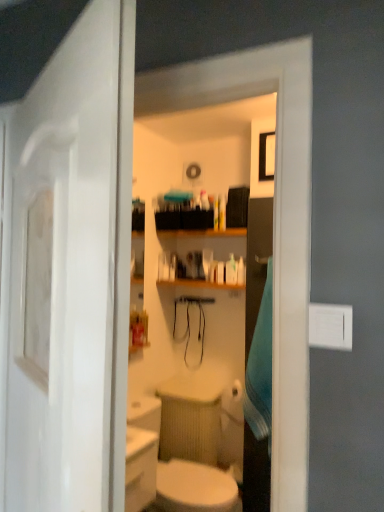
Where is `blue fabric towel at right`? The width and height of the screenshot is (384, 512). blue fabric towel at right is located at coordinates (261, 368).

Locate an element on the screen. blue fabric towel at right is located at coordinates (261, 368).

Does white glossy door at left have a lesser height compared to white glossy sink at lower center?

No, white glossy door at left is not shorter than white glossy sink at lower center.

From the image's perspective, which is below, white glossy door at left or white glossy sink at lower center?

white glossy sink at lower center, from the image's perspective.

From the picture: Between white glossy door at left and white glossy sink at lower center, which one appears on the right side from the viewer's perspective?

white glossy sink at lower center is more to the right.

Looking at this image, can you confirm if white glossy door at left is bigger than white glossy sink at lower center?

Incorrect, white glossy door at left is not larger than white glossy sink at lower center.

Looking at this image, what's the angular difference between blue fabric towel at right and white glossy door at left's facing directions?

The facing directions of blue fabric towel at right and white glossy door at left are 151 degrees apart.

In the image, is blue fabric towel at right on the left side or the right side of white glossy door at left?

blue fabric towel at right is positioned on white glossy door at left's right side.

Considering the positions of objects blue fabric towel at right and white glossy door at left in the image provided, who is behind, blue fabric towel at right or white glossy door at left?

blue fabric towel at right is further away from the camera.

I want to click on door lying above the blue fabric towel at right (from the image's perspective), so click(x=61, y=274).

From the picture: Which point is more forward, (36, 282) or (249, 391)?

The point (36, 282) is more forward.

Is white glossy door at left aimed at blue fabric towel at right?

Yes, white glossy door at left is aimed at blue fabric towel at right.

From a real-world perspective, which object stands above the other?

white glossy door at left.

From the picture: From the image's perspective, between blue fabric towel at right and white glossy sink at lower center, which one is located above?

blue fabric towel at right appears higher in the image.

From the picture: Is blue fabric towel at right inside the boundaries of white glossy sink at lower center, or outside?

blue fabric towel at right is not enclosed by white glossy sink at lower center.

From a real-world perspective, is blue fabric towel at right positioned over white glossy sink at lower center based on gravity?

Yes.

How distant is blue fabric towel at right from white glossy sink at lower center?

blue fabric towel at right is 21.36 inches from white glossy sink at lower center.

From the image's perspective, is white glossy sink at lower center beneath white glossy door at left?

Indeed, from the image's perspective, white glossy sink at lower center is shown beneath white glossy door at left.

From a real-world perspective, is white glossy sink at lower center physically located above or below white glossy door at left?

white glossy sink at lower center is situated lower than white glossy door at left in the real world.

In order to click on door in front of the white glossy sink at lower center in this screenshot , I will do `click(61, 274)`.

Is white glossy sink at lower center facing away from white glossy door at left?

No, white glossy sink at lower center's orientation is not away from white glossy door at left.

Is white glossy sink at lower center closer to the viewer compared to blue fabric towel at right?

Yes, the depth of white glossy sink at lower center is less than that of blue fabric towel at right.

From a real-world perspective, is white glossy sink at lower center positioned over blue fabric towel at right based on gravity?

Incorrect, from a real-world perspective, white glossy sink at lower center is lower than blue fabric towel at right.

Is the surface of white glossy sink at lower center in direct contact with blue fabric towel at right?

white glossy sink at lower center and blue fabric towel at right are not in contact.

Looking at this image, in terms of height, does white glossy sink at lower center look taller or shorter compared to blue fabric towel at right?

In the image, white glossy sink at lower center appears to be shorter than blue fabric towel at right.

The height and width of the screenshot is (512, 384). I want to click on sink below the white glossy door at left (from the image's perspective), so click(169, 470).

Identify the location of door that appears on the left of blue fabric towel at right. (61, 274).

Looking at the image, which one is located further to blue fabric towel at right, white glossy sink at lower center or white glossy door at left?

Based on the image, white glossy door at left appears to be further to blue fabric towel at right.

From the image, which object appears to be nearer to white glossy door at left, white glossy sink at lower center or blue fabric towel at right?

Among the two, white glossy sink at lower center is located nearer to white glossy door at left.

Considering their positions, is blue fabric towel at right positioned further to white glossy sink at lower center than white glossy door at left?

Based on the image, white glossy door at left appears to be further to white glossy sink at lower center.

When comparing their distances from white glossy sink at lower center, does white glossy door at left or blue fabric towel at right seem further?

white glossy door at left is positioned further to the anchor white glossy sink at lower center.

Looking at the image, which one is located further to blue fabric towel at right, white glossy door at left or white glossy sink at lower center?

The object further to blue fabric towel at right is white glossy door at left.

Estimate the real-world distances between objects in this image. Which object is further from white glossy door at left, blue fabric towel at right or white glossy sink at lower center?

blue fabric towel at right is positioned further to the anchor white glossy door at left.

At what (x,y) coordinates should I click in order to perform the action: click on sink positioned between white glossy door at left and blue fabric towel at right from near to far. Please return your answer as a coordinate pair (x, y). Looking at the image, I should click on (169, 470).